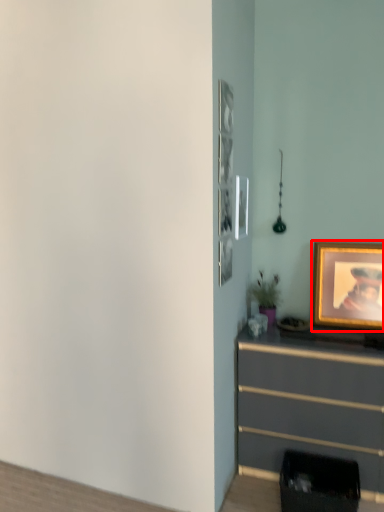
Question: Observing the image, what is the correct spatial positioning of picture frame (annotated by the red box) in reference to chest of drawers?

Choices:
 (A) right
 (B) left

Answer: (A)